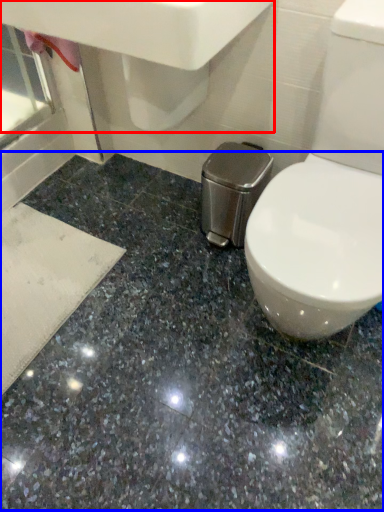
Question: Among these objects, which one is nearest to the camera, sink (highlighted by a red box) or granite (highlighted by a blue box)?

Choices:
 (A) sink
 (B) granite

Answer: (B)